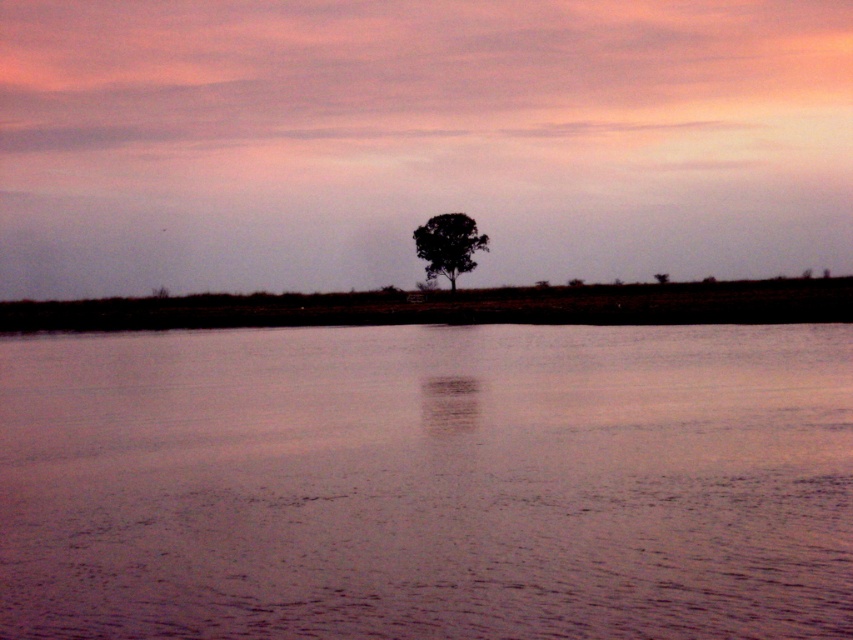
Is smooth water at center further to the viewer compared to silhouette textured tree at center?

No, it is not.

Who is lower down, smooth water at center or silhouette textured tree at center?

smooth water at center is below.

What do you see at coordinates (427, 483) in the screenshot? This screenshot has width=853, height=640. I see `smooth water at center` at bounding box center [427, 483].

The image size is (853, 640). What are the coordinates of `smooth water at center` in the screenshot? It's located at (427, 483).